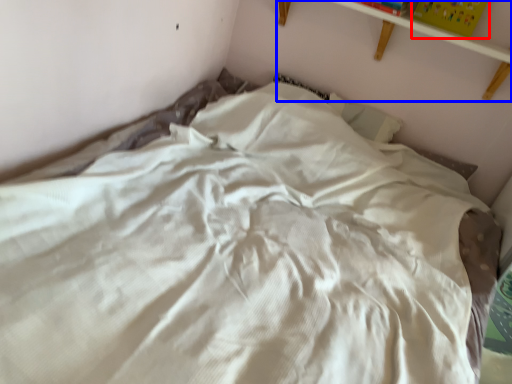
Question: Which object is closer to the camera taking this photo, paperback book (highlighted by a red box) or shelf (highlighted by a blue box)?

Choices:
 (A) paperback book
 (B) shelf

Answer: (B)